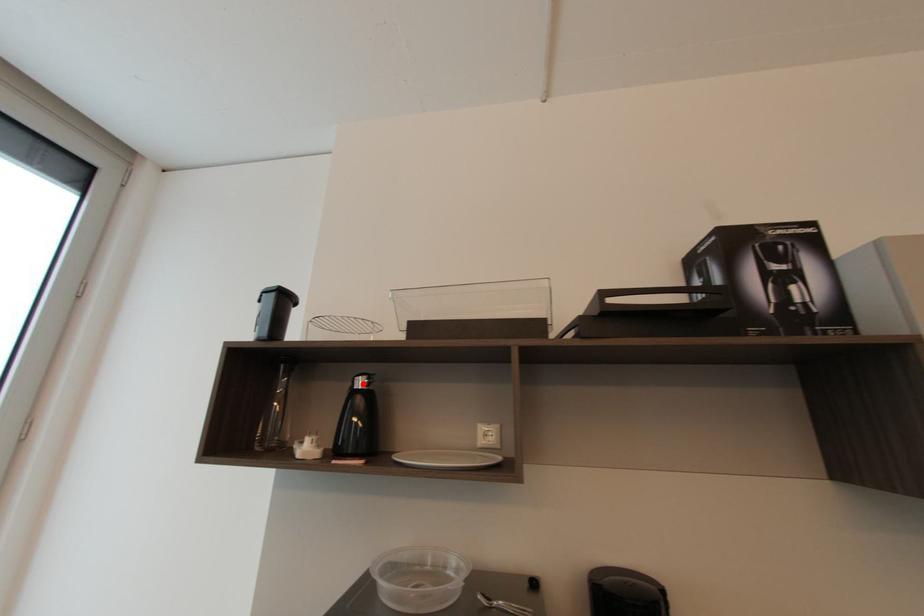
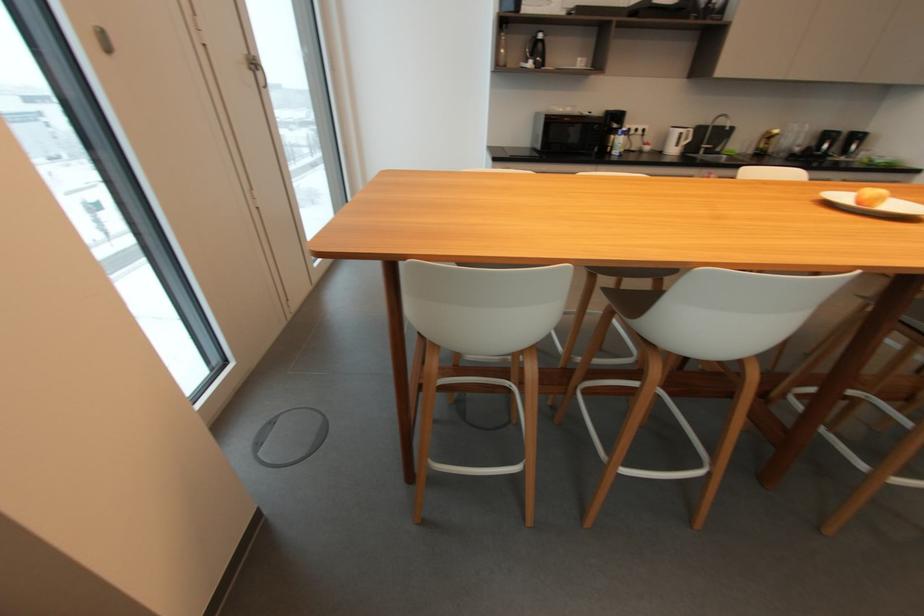
Find the pixel in the second image that matches the highlighted location in the first image.

(544, 36)